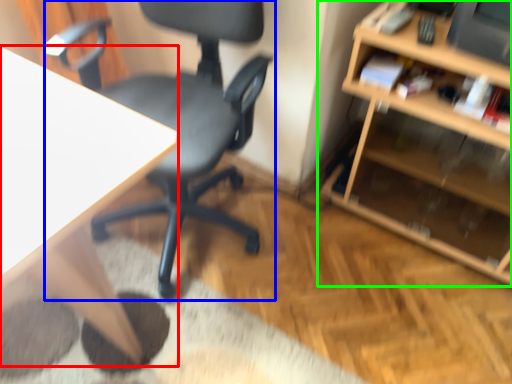
Question: Estimate the real-world distances between objects in this image. Which object is closer to desk (highlighted by a red box), chair (highlighted by a blue box) or shelf (highlighted by a green box)?

Choices:
 (A) chair
 (B) shelf

Answer: (A)